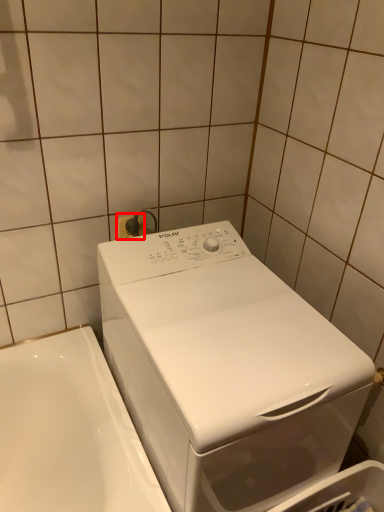
Question: From the image's perspective, where is electric outlet (annotated by the red box) located in relation to washing machine in the image?

Choices:
 (A) below
 (B) above

Answer: (B)